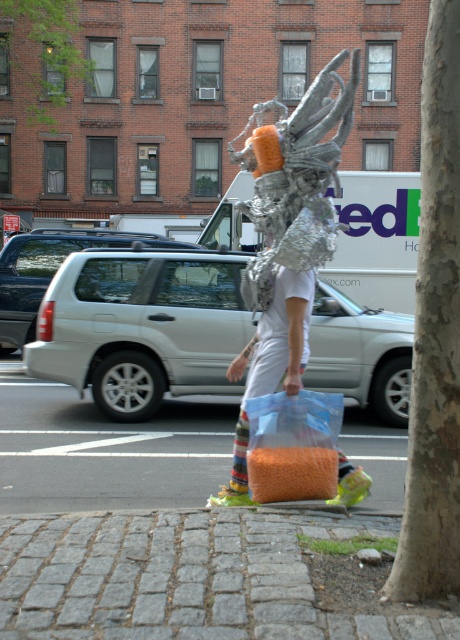
Question: Which point is closer to the camera?

Choices:
 (A) shiny metallic mask at center
 (B) translucent plastic bag at center
 (C) brown rough bark tree at right

Answer: (C)

Question: Is brown rough bark tree at right positioned in front of shiny metallic mask at center?

Choices:
 (A) no
 (B) yes

Answer: (B)

Question: Based on their relative distances, which object is farther from the translucent plastic bag at center?

Choices:
 (A) brown rough bark tree at right
 (B) shiny metallic mask at center

Answer: (B)

Question: Can you confirm if translucent plastic bag at center is smaller than shiny metallic mask at center?

Choices:
 (A) no
 (B) yes

Answer: (A)

Question: Is brown rough bark tree at right closer to camera compared to shiny metallic mask at center?

Choices:
 (A) yes
 (B) no

Answer: (A)

Question: Among these objects, which one is nearest to the camera?

Choices:
 (A) shiny metallic mask at center
 (B) translucent plastic bag at center
 (C) brown rough bark tree at right

Answer: (C)